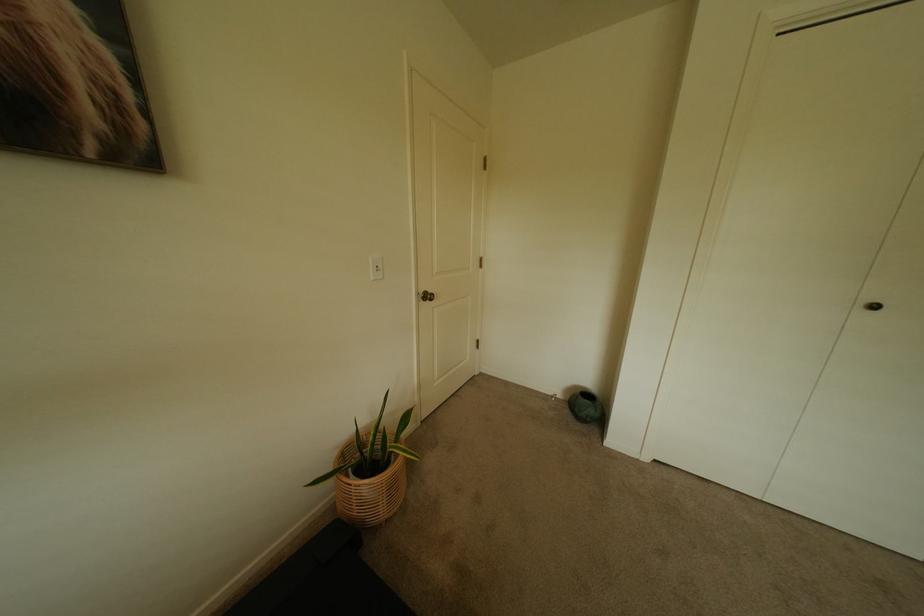
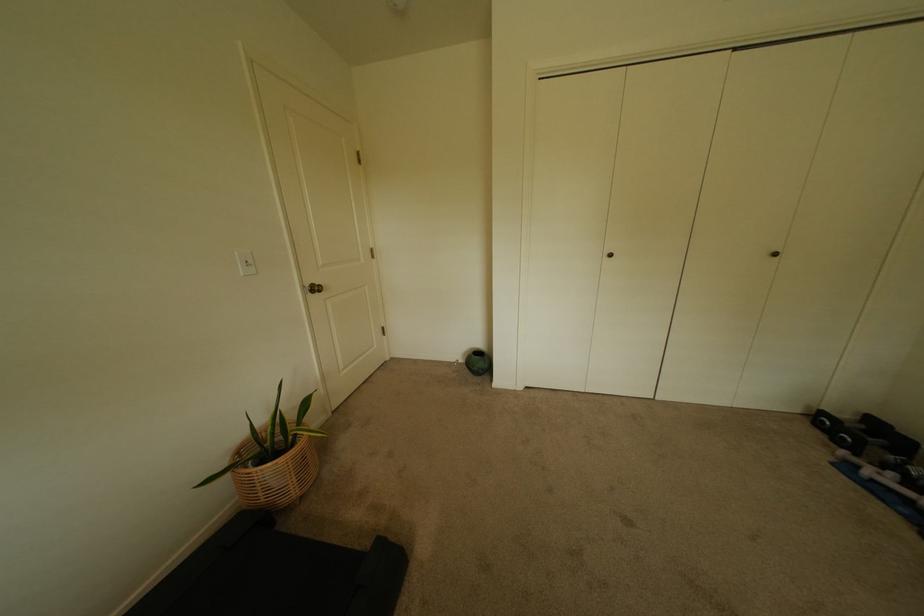
The point at (576, 411) is marked in the first image. Where is the corresponding point in the second image?

(476, 371)